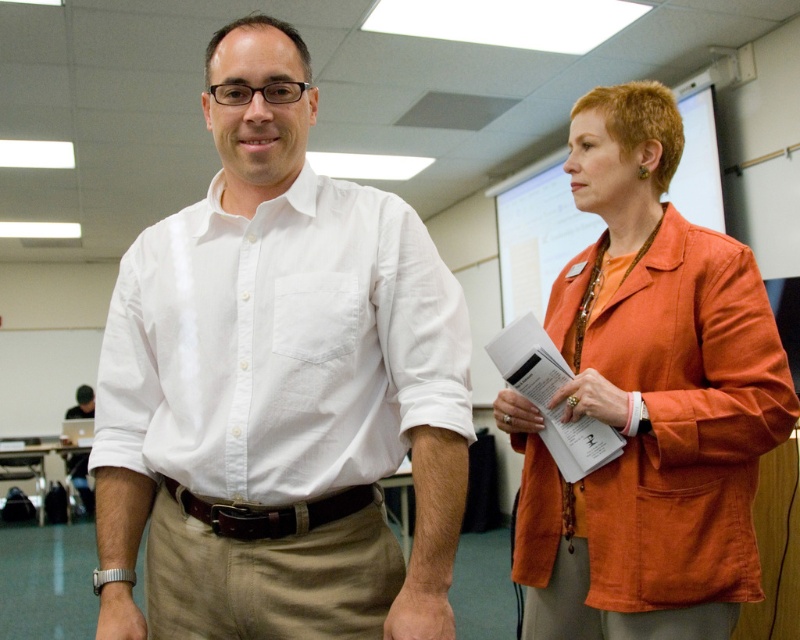
You are organizing a classroom event and need to hang a poster on the orange fabric bulletin board at upper right and attach a name tag to the brown leather belt at center. Which object will require more space to accommodate the items?

The orange fabric bulletin board at upper right requires more space because it is larger in size than the brown leather belt at center.

You are a teacher in a classroom and need to hang a large poster that requires a lot of vertical space. Based on the scene, which object between the orange fabric bulletin board at upper right and the brown leather belt at center would be more suitable for hanging the poster?

The orange fabric bulletin board at upper right is much taller than the brown leather belt at center, so it would be more suitable for hanging the large poster that requires a lot of vertical space.

Based on the photo, you are standing in the classroom and want to reach the point at coordinates (256, 56). If your walking speed is 3 feet per second, how many seconds will it take you to reach that point?

The point at coordinates (256, 56) is 3.83 feet away from the viewer. At a walking speed of 3 feet per second, it will take approximately 1.28 seconds to reach the point.